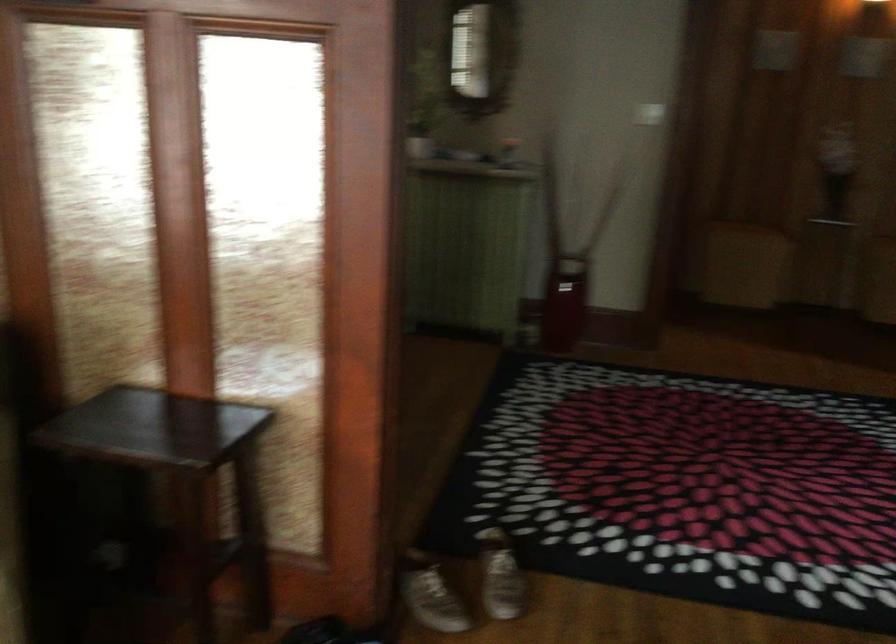
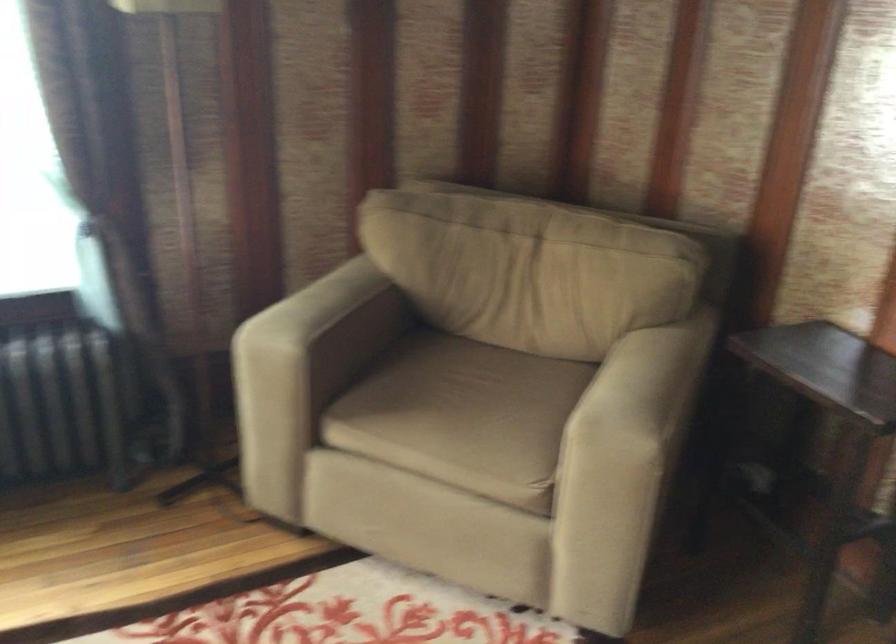
Find the pixel in the second image that matches pixel 156 431 in the first image.

(826, 368)